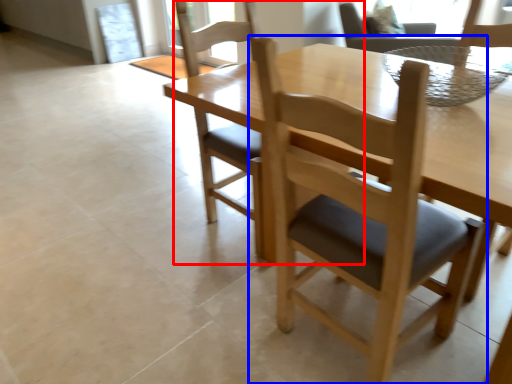
Question: Which object is closer to the camera taking this photo, chair (highlighted by a red box) or chair (highlighted by a blue box)?

Choices:
 (A) chair
 (B) chair

Answer: (B)